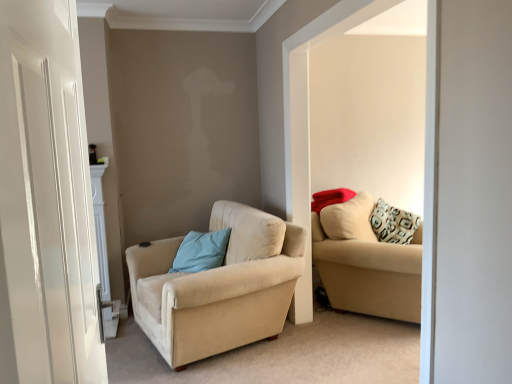
Question: Is beige fabric couch at right closer to the viewer compared to beige fabric couch at right, the 2th studio couch positioned from the left?

Choices:
 (A) yes
 (B) no

Answer: (A)

Question: Is the depth of beige fabric couch at right greater than that of beige fabric couch at right, the 2th studio couch positioned from the left?

Choices:
 (A) yes
 (B) no

Answer: (B)

Question: Does beige fabric couch at right have a lesser width compared to beige fabric couch at right, the 2th studio couch positioned from the left?

Choices:
 (A) yes
 (B) no

Answer: (A)

Question: Could you tell me if beige fabric couch at right is turned towards beige fabric couch at right, the 2th studio couch positioned from the left?

Choices:
 (A) yes
 (B) no

Answer: (B)

Question: From the image's perspective, does beige fabric couch at right appear higher than beige fabric couch at right, the 2th studio couch positioned from the left?

Choices:
 (A) no
 (B) yes

Answer: (B)

Question: From the image's perspective, is beige fabric couch at right below beige fabric couch at right, the 2th studio couch positioned from the left?

Choices:
 (A) yes
 (B) no

Answer: (B)

Question: Does beige fabric couch at right, the 2th studio couch positioned from the left, have a lesser height compared to light blue fabric pillow at center-left?

Choices:
 (A) no
 (B) yes

Answer: (A)

Question: From the image's perspective, is beige fabric couch at right, the 2th studio couch positioned from the left, on top of light blue fabric pillow at center-left?

Choices:
 (A) yes
 (B) no

Answer: (B)

Question: Can we say beige fabric couch at right, the 2th studio couch positioned from the left, lies outside light blue fabric pillow at center-left?

Choices:
 (A) yes
 (B) no

Answer: (A)

Question: Is beige fabric couch at right, the 2th studio couch positioned from the left, to the left of light blue fabric pillow at center-left from the viewer's perspective?

Choices:
 (A) yes
 (B) no

Answer: (B)

Question: Is beige fabric couch at right, the first studio couch from the right, not near light blue fabric pillow at center-left?

Choices:
 (A) no
 (B) yes

Answer: (A)

Question: Is beige fabric couch at right, the first studio couch from the right, to the right of light blue fabric pillow at center-left from the viewer's perspective?

Choices:
 (A) no
 (B) yes

Answer: (B)

Question: Does beige fabric couch at right have a smaller size compared to light blue fabric pillow at center-left?

Choices:
 (A) no
 (B) yes

Answer: (A)